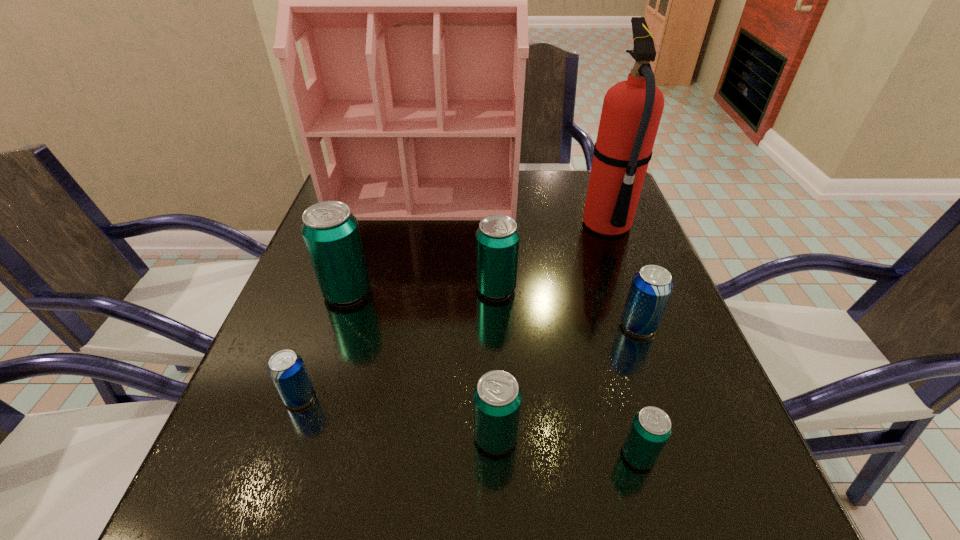
At what (x,y) coordinates should I click in order to perform the action: click on vacant space at the near edge of the desktop. Please return your answer as a coordinate pair (x, y). The width and height of the screenshot is (960, 540). Looking at the image, I should click on (591, 498).

Locate an element on the screen. vacant area at the left edge is located at coordinates (300, 298).

Where is `vacant region at the right edge of the desktop`? vacant region at the right edge of the desktop is located at coordinates (592, 272).

Find the location of a particular element. free space at the near right corner is located at coordinates (682, 486).

The height and width of the screenshot is (540, 960). Identify the location of empty location between the tallest beer can and the second biggest teal beer can. (421, 290).

Image resolution: width=960 pixels, height=540 pixels. Find the location of `empty space that is in between the biggest teal beer can and the second tallest beer can`. empty space that is in between the biggest teal beer can and the second tallest beer can is located at coordinates (421, 290).

The image size is (960, 540). I want to click on vacant area between the leftmost teal beer can and the sixth farthest object, so click(324, 344).

Find the location of `vacant area between the right blue beer can and the second beer can from right to left`. vacant area between the right blue beer can and the second beer can from right to left is located at coordinates (638, 390).

Where is `unoccupied area between the fifth shortest object and the dollhouse`? unoccupied area between the fifth shortest object and the dollhouse is located at coordinates (460, 243).

The width and height of the screenshot is (960, 540). What are the coordinates of `vacant space that is in between the rightmost teal beer can and the dollhouse` in the screenshot? It's located at (531, 327).